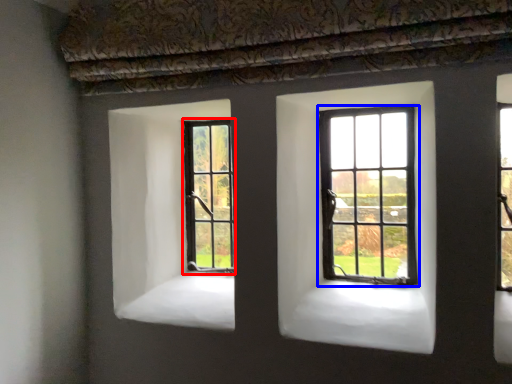
Question: Which of the following is the farthest to the observer, window (highlighted by a red box) or window (highlighted by a blue box)?

Choices:
 (A) window
 (B) window

Answer: (A)